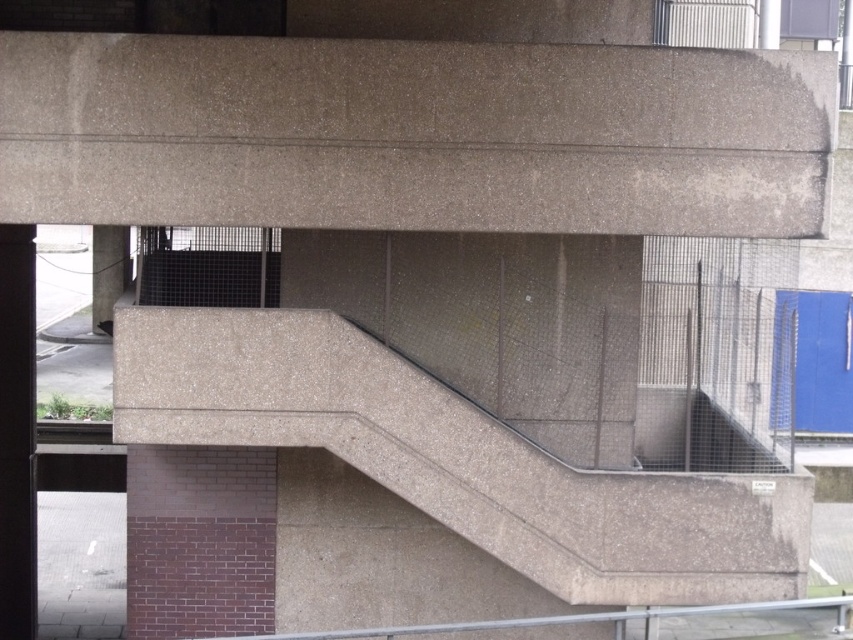
Question: Can you confirm if concrete stairwell at center is positioned below black glossy pillar at left?

Choices:
 (A) yes
 (B) no

Answer: (B)

Question: Is the position of black glossy pillar at left less distant than that of concrete pillar at lower left?

Choices:
 (A) yes
 (B) no

Answer: (B)

Question: In this image, where is black glossy pillar at left located relative to concrete pillar at lower left?

Choices:
 (A) right
 (B) left

Answer: (A)

Question: Which point is closer to the camera taking this photo?

Choices:
 (A) (122, 291)
 (B) (473, 589)

Answer: (B)

Question: Which point is farther from the camera taking this photo?

Choices:
 (A) (1, 234)
 (B) (97, 278)

Answer: (B)

Question: Which object appears farthest from the camera in this image?

Choices:
 (A) concrete pillar at lower left
 (B) concrete stairwell at center
 (C) black glossy pillar at left

Answer: (C)